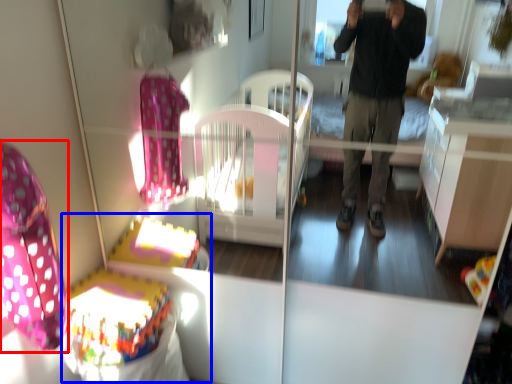
Question: Which object is further to the camera taking this photo, swivel chair (highlighted by a red box) or baby carriage (highlighted by a blue box)?

Choices:
 (A) swivel chair
 (B) baby carriage

Answer: (B)